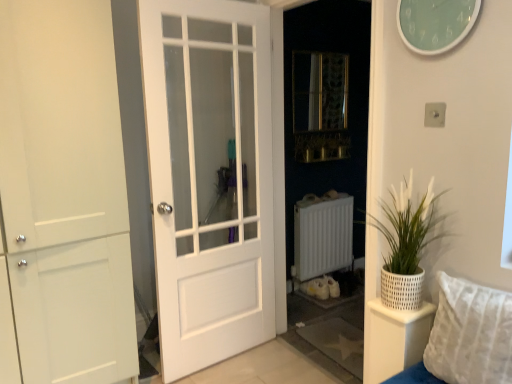
The width and height of the screenshot is (512, 384). Identify the location of white textured pillow at lower right. (470, 333).

Describe the element at coordinates (322, 235) in the screenshot. The image size is (512, 384). I see `white matte radiator at center` at that location.

What is the approximate width of white textured pot at right?

The width of white textured pot at right is 21.20 centimeters.

Identify the location of white textured pillow at lower right. The width and height of the screenshot is (512, 384). (470, 333).

Would you say white woven basket at right contains teal glass clock at upper right?

No, teal glass clock at upper right is not a part of white woven basket at right.

From the image's perspective, is white woven basket at right located beneath teal glass clock at upper right?

Yes, from the image's perspective, white woven basket at right is below teal glass clock at upper right.

Considering the relative sizes of white woven basket at right and teal glass clock at upper right in the image provided, is white woven basket at right bigger than teal glass clock at upper right?

Correct, white woven basket at right is larger in size than teal glass clock at upper right.

Is white woven basket at right thinner than teal glass clock at upper right?

In fact, white woven basket at right might be wider than teal glass clock at upper right.

Does white matte door at left, marked as the 1th door in a left-to-right arrangement, have a smaller size compared to white textured pillow at lower right?

Incorrect, white matte door at left, marked as the 1th door in a left-to-right arrangement, is not smaller in size than white textured pillow at lower right.

From the image's perspective, is white matte door at left, which ranks as the second door in right-to-left order, over white textured pillow at lower right?

Correct, white matte door at left, which ranks as the second door in right-to-left order, appears higher than white textured pillow at lower right in the image.

Considering the relative positions of white matte door at left, marked as the 1th door in a left-to-right arrangement, and white textured pillow at lower right in the image provided, is white matte door at left, marked as the 1th door in a left-to-right arrangement, in front of white textured pillow at lower right?

No, white matte door at left, marked as the 1th door in a left-to-right arrangement, is further to the viewer.

Is white textured pillow at lower right completely or partially inside white matte door at left, which ranks as the second door in right-to-left order?

No, white textured pillow at lower right is located outside of white matte door at left, which ranks as the second door in right-to-left order.

Measure the distance between white matte door at left, marked as the 1th door in a left-to-right arrangement, and white woven basket at right.

white matte door at left, marked as the 1th door in a left-to-right arrangement, and white woven basket at right are 4.22 feet apart.

Who is smaller, white matte door at left, marked as the 1th door in a left-to-right arrangement, or white woven basket at right?

Smaller between the two is white woven basket at right.

Can we say white matte door at left, marked as the 1th door in a left-to-right arrangement, lies outside white woven basket at right?

Yes, white matte door at left, marked as the 1th door in a left-to-right arrangement, is outside of white woven basket at right.

Is white matte door at left, marked as the 1th door in a left-to-right arrangement, far from white woven basket at right?

Indeed, white matte door at left, marked as the 1th door in a left-to-right arrangement, is not near white woven basket at right.

How far apart are white matte radiator at center and white textured pot at right?

white matte radiator at center is 1.51 meters away from white textured pot at right.

Can you confirm if white matte radiator at center is smaller than white textured pot at right?

No.

Is white textured pot at right inside white matte radiator at center?

No, white textured pot at right is located outside of white matte radiator at center.

Which object is positioned more to the right, white matte radiator at center or white textured pot at right?

white textured pot at right is more to the right.

Does point (392, 212) lie behind point (382, 370)?

That is True.

From their relative heights in the image, would you say white textured pot at right is taller or shorter than white woven basket at right?

In the image, white textured pot at right appears to be taller than white woven basket at right.

Does white textured pot at right have a larger size compared to white woven basket at right?

Correct, white textured pot at right is larger in size than white woven basket at right.

From a real-world perspective, is white textured pot at right located higher than white woven basket at right?

Yes, from a real-world perspective, white textured pot at right is over white woven basket at right

Is white matte radiator at center inside or outside of metallic mesh at center?

white matte radiator at center is spatially situated outside metallic mesh at center.

At what (x,y) coordinates should I click in order to perform the action: click on window screen above the white matte radiator at center (from the image's perspective). Please return your answer as a coordinate pair (x, y). Image resolution: width=512 pixels, height=384 pixels. Looking at the image, I should click on (319, 91).

How distant is white matte radiator at center from metallic mesh at center?

The distance of white matte radiator at center from metallic mesh at center is 3.77 feet.

Are white matte radiator at center and metallic mesh at center beside each other?

No, white matte radiator at center is not next to metallic mesh at center.

Considering the relative sizes of white glass door at center, which is the second door from left to right, and metallic mesh at center in the image provided, is white glass door at center, which is the second door from left to right, shorter than metallic mesh at center?

No.

From a real-world perspective, is white glass door at center, the 1th door when ordered from right to left, on metallic mesh at center?

No, from a real-world perspective, white glass door at center, the 1th door when ordered from right to left, is not above metallic mesh at center.

Is there a large distance between white glass door at center, the 1th door when ordered from right to left, and metallic mesh at center?

That's right, there is a large distance between white glass door at center, the 1th door when ordered from right to left, and metallic mesh at center.

Locate an element on the screen. This screenshot has height=384, width=512. window screen that is above the white glass door at center, which is the second door from left to right (from the image's perspective) is located at coordinates (319, 91).

The width and height of the screenshot is (512, 384). I want to click on clock on the right of white woven basket at right, so click(435, 23).

From the image's perspective, count 1st doors upward from the white textured pillow at lower right and point to it. Please provide its 2D coordinates.

[(65, 193)]

When comparing their distances from white textured pot at right, does teal glass clock at upper right or white matte door at left, which ranks as the second door in right-to-left order, seem further?

white matte door at left, which ranks as the second door in right-to-left order.

When comparing their distances from white glass door at center, the 1th door when ordered from right to left, does teal glass clock at upper right or white textured pillow at lower right seem closer?

The object closer to white glass door at center, the 1th door when ordered from right to left, is teal glass clock at upper right.

From the image, which object appears to be nearer to metallic mesh at center, white textured pillow at lower right or white matte door at left, marked as the 1th door in a left-to-right arrangement?

Based on the image, white matte door at left, marked as the 1th door in a left-to-right arrangement, appears to be nearer to metallic mesh at center.

When comparing their distances from white woven basket at right, does metallic mesh at center or white textured pot at right seem further?

The object further to white woven basket at right is metallic mesh at center.

When comparing their distances from white glass door at center, the 1th door when ordered from right to left, does teal glass clock at upper right or white woven basket at right seem further?

Based on the image, teal glass clock at upper right appears to be further to white glass door at center, the 1th door when ordered from right to left.

Estimate the real-world distances between objects in this image. Which object is closer to white textured pot at right, white glass door at center, the 1th door when ordered from right to left, or white textured pillow at lower right?

white textured pillow at lower right lies closer to white textured pot at right than the other object.

Looking at the image, which one is located closer to metallic mesh at center, white textured pot at right or teal glass clock at upper right?

teal glass clock at upper right is closer to metallic mesh at center.

When comparing their distances from white glass door at center, the 1th door when ordered from right to left, does white textured pillow at lower right or white matte radiator at center seem closer?

white matte radiator at center lies closer to white glass door at center, the 1th door when ordered from right to left, than the other object.

The image size is (512, 384). I want to click on houseplant between white textured pillow at lower right and metallic mesh at center from front to back, so click(x=405, y=244).

The image size is (512, 384). I want to click on window screen between white textured pillow at lower right and white matte radiator at center from front to back, so click(319, 91).

Where is `furniture located between white matte door at left, marked as the 1th door in a left-to-right arrangement, and white textured pillow at lower right in the left-right direction`? The width and height of the screenshot is (512, 384). furniture located between white matte door at left, marked as the 1th door in a left-to-right arrangement, and white textured pillow at lower right in the left-right direction is located at coordinates (394, 339).

I want to click on door between white matte door at left, marked as the 1th door in a left-to-right arrangement, and white woven basket at right, so click(x=209, y=176).